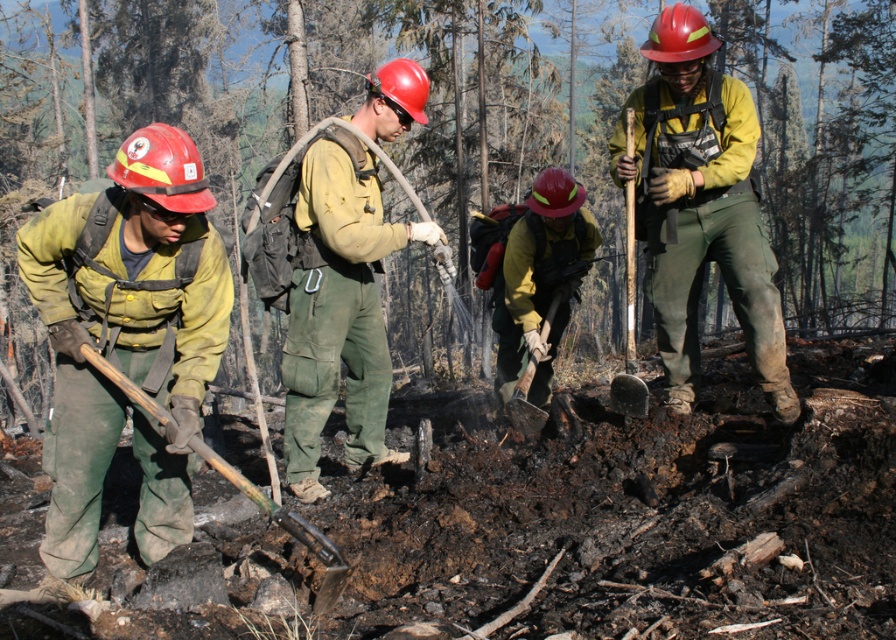
Question: Is matte green uniform at left wider than matte green pants at center?

Choices:
 (A) yes
 (B) no

Answer: (A)

Question: Which is farther from the matte green uniform at left?

Choices:
 (A) green canvas pants at center
 (B) matte green pants at center

Answer: (B)

Question: Among these objects, which one is farthest from the camera?

Choices:
 (A) matte yellow jacket at center
 (B) rusty metal shovel at center
 (C) matte green uniform at left
 (D) green matte shovel at center

Answer: (A)

Question: In this image, where is matte green uniform at left located relative to wooden shovel at center?

Choices:
 (A) right
 (B) left

Answer: (B)

Question: Which object is positioned closest to the matte green pants at center?

Choices:
 (A) green matte shovel at center
 (B) wooden handle shovel at lower left
 (C) wooden shovel at center

Answer: (C)

Question: Can you confirm if green canvas pants at center is positioned to the right of matte green pants at center?

Choices:
 (A) no
 (B) yes

Answer: (B)